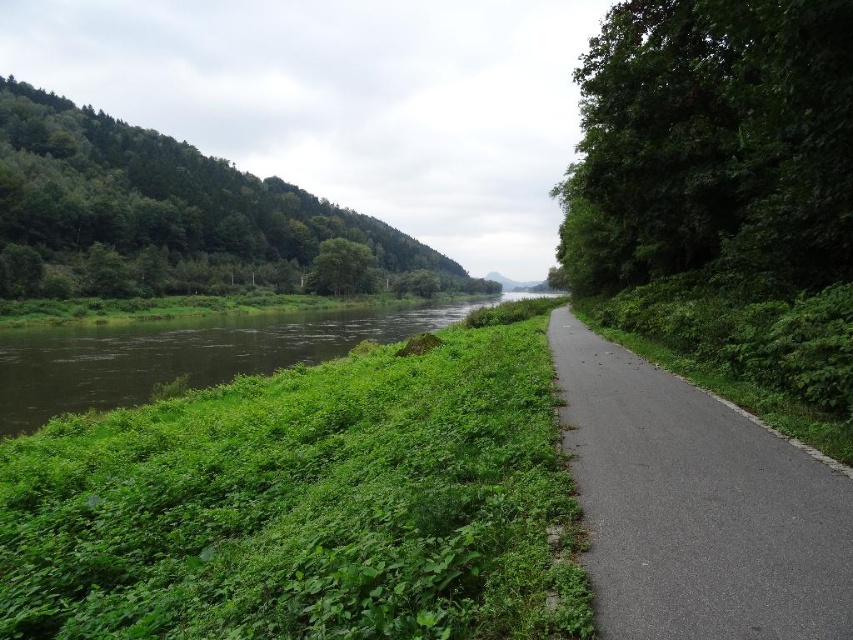
Does green leafy tree at right have a smaller size compared to green leafy tree at center?

Correct, green leafy tree at right occupies less space than green leafy tree at center.

Does green leafy tree at right appear under green leafy tree at center?

Correct, green leafy tree at right is located below green leafy tree at center.

Between point (721, 248) and point (354, 259), which one is positioned in front?

Point (721, 248) is more forward.

Identify the location of green leafy tree at right. The height and width of the screenshot is (640, 853). (712, 144).

Is green leafy tree at right to the right of black asphalt path at right from the viewer's perspective?

Indeed, green leafy tree at right is positioned on the right side of black asphalt path at right.

Which of these two, green leafy tree at right or black asphalt path at right, stands shorter?

black asphalt path at right

Find the location of a particular element. This screenshot has width=853, height=640. green leafy tree at right is located at coordinates (712, 144).

Identify the location of green leafy tree at right. (712, 144).

Between green leafy tree at left and green grassy river at center, which one has less height?

With less height is green grassy river at center.

Between green leafy tree at left and green grassy river at center, which one is positioned lower?

green grassy river at center is lower down.

Locate an element on the screen. green leafy tree at left is located at coordinates (166, 214).